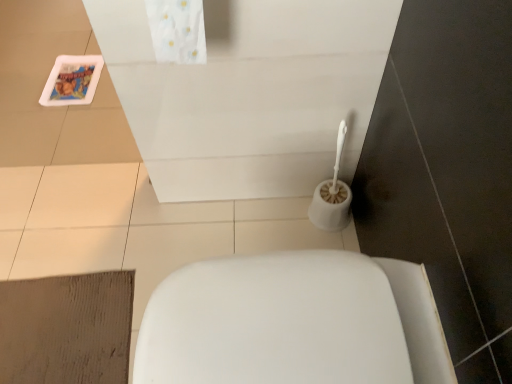
Consider the image. What is the approximate width of white glossy toilet at lower right?

white glossy toilet at lower right is 20.48 inches in width.

At what (x,y) coordinates should I click in order to perform the action: click on white glossy toilet at lower right. Please return your answer as a coordinate pair (x, y). The width and height of the screenshot is (512, 384). Looking at the image, I should click on (294, 323).

What do you see at coordinates (294, 323) in the screenshot? The image size is (512, 384). I see `white glossy toilet at lower right` at bounding box center [294, 323].

Find the location of a particular element. Image resolution: width=512 pixels, height=384 pixels. white glossy toilet at lower right is located at coordinates (294, 323).